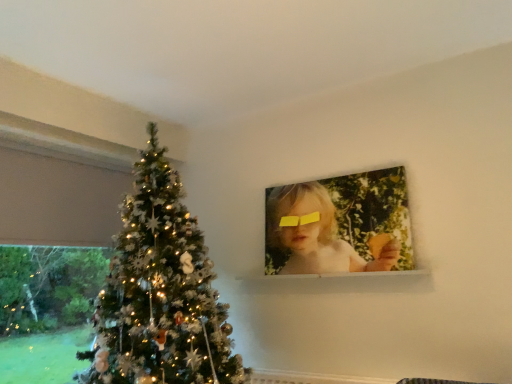
The width and height of the screenshot is (512, 384). Identify the location of matte plastic photo at upper right. (317, 234).

Describe the element at coordinates (317, 234) in the screenshot. I see `matte plastic photo at upper right` at that location.

At what (x,y) coordinates should I click in order to perform the action: click on matte plastic photo at upper right. Please return your answer as a coordinate pair (x, y). The width and height of the screenshot is (512, 384). Looking at the image, I should click on (317, 234).